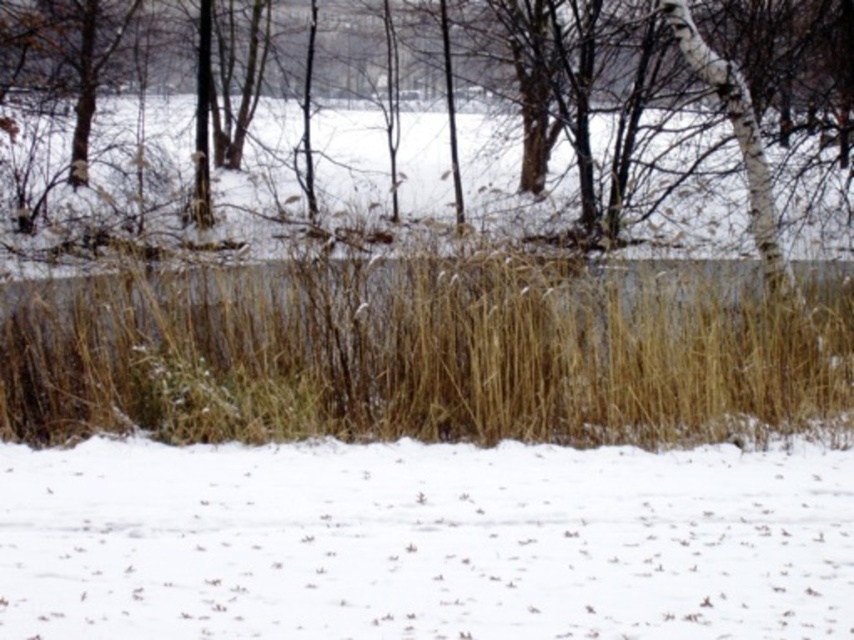
You are planning to build a snowman using the white fluffy snow at lower center and the brown grass at center. Which material would be more suitable for the base of the snowman and why?

The white fluffy snow at lower center is more suitable for the base of the snowman because it has a smaller size compared to the brown grass at center, making it easier to compact and form a stable structure.

You are an animal trying to cross the white fluffy snow at lower center and the brown grass at center. Which path has a narrower width for you to walk on?

The white fluffy snow at lower center has a lesser width compared to brown grass at center, so the path on the white fluffy snow at lower center is narrower.